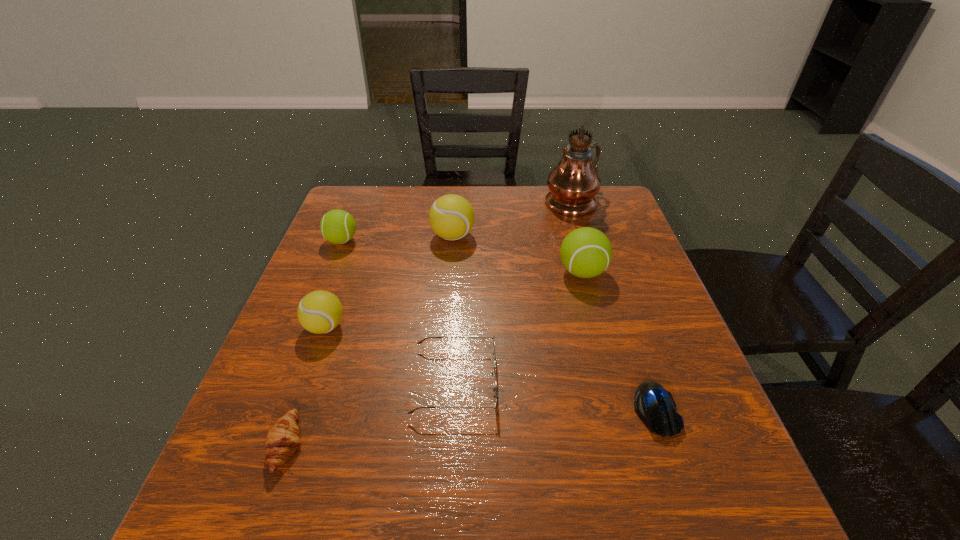
The image size is (960, 540). In order to click on vacant area that lies between the nearest tennis ball and the fourth farthest object in this screenshot , I will do `click(454, 300)`.

The image size is (960, 540). I want to click on vacant space that's between the tallest object and the smaller yellow tennis ball, so click(x=448, y=264).

The height and width of the screenshot is (540, 960). Find the location of `free space between the seventh tallest object and the tallest object`. free space between the seventh tallest object and the tallest object is located at coordinates (429, 323).

The width and height of the screenshot is (960, 540). Identify the location of vacant space that's between the shortest object and the tallest object. (614, 306).

The height and width of the screenshot is (540, 960). I want to click on vacant space in between the oil lamp and the green sunglasses, so click(x=514, y=291).

Locate which object is the fifth closest to the left green tennis ball. Please provide its 2D coordinates. Your answer should be formatted as a tuple, i.e. [(x, y)], where the tuple contains the x and y coordinates of a point satisfying the conditions above.

[(586, 252)]

Identify which object is the sixth closest to the tallest object. Please provide its 2D coordinates. Your answer should be formatted as a tuple, i.e. [(x, y)], where the tuple contains the x and y coordinates of a point satisfying the conditions above.

[(319, 312)]

What are the coordinates of `tennis ball identified as the fourth closest to the shortest object` in the screenshot? It's located at (337, 226).

The width and height of the screenshot is (960, 540). What are the coordinates of `the closest tennis ball to the smaller green tennis ball` in the screenshot? It's located at (451, 217).

The image size is (960, 540). Identify the location of vacant region that satisfies the following two spatial constraints: 1. on the front side of the tallest object; 2. on the front-facing side of the third shortest object. (626, 381).